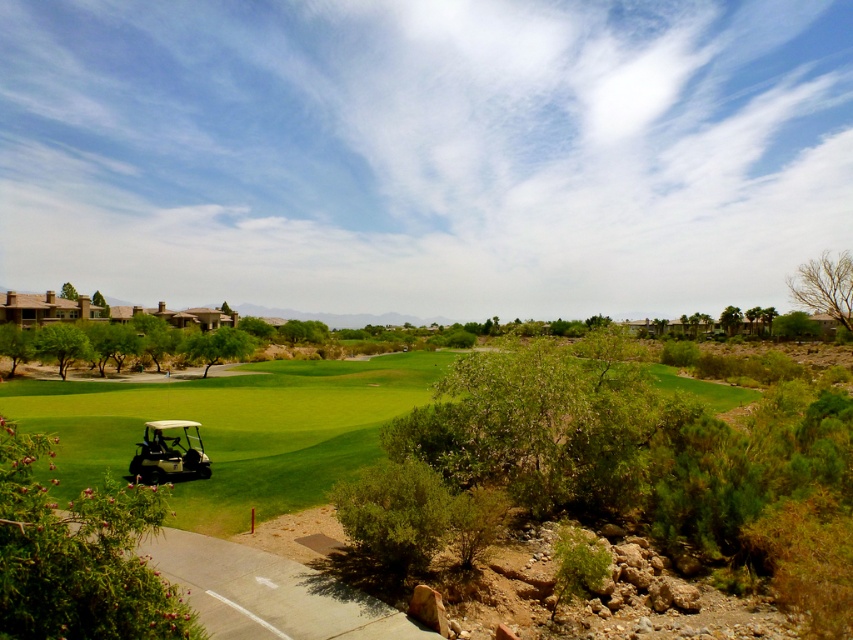
You are a golfer who wants to choose a golf cart to ride on the course. Both the white plastic golf cart at lower left and the white matte golf cart at lower left are available. Which one should you pick if you want the larger one?

The white plastic golf cart at lower left is bigger than the white matte golf cart at lower left, so you should pick the white plastic golf cart at lower left.

In the scene shown: You are a golfer standing on the golf course and want to take the white plastic golf cart at lower left and the white matte golf cart at lower left for your round. Which one is closer to you?

The white plastic golf cart at lower left is closer to you because it is in front of the white matte golf cart at lower left.

You are a golfer who needs to choose between the white plastic golf cart at lower left and the white matte golf cart at lower left for carrying your golf clubs. Which one has more vertical space inside for your equipment?

The white plastic golf cart at lower left is taller than the white matte golf cart at lower left, so it has more vertical space inside for your equipment.